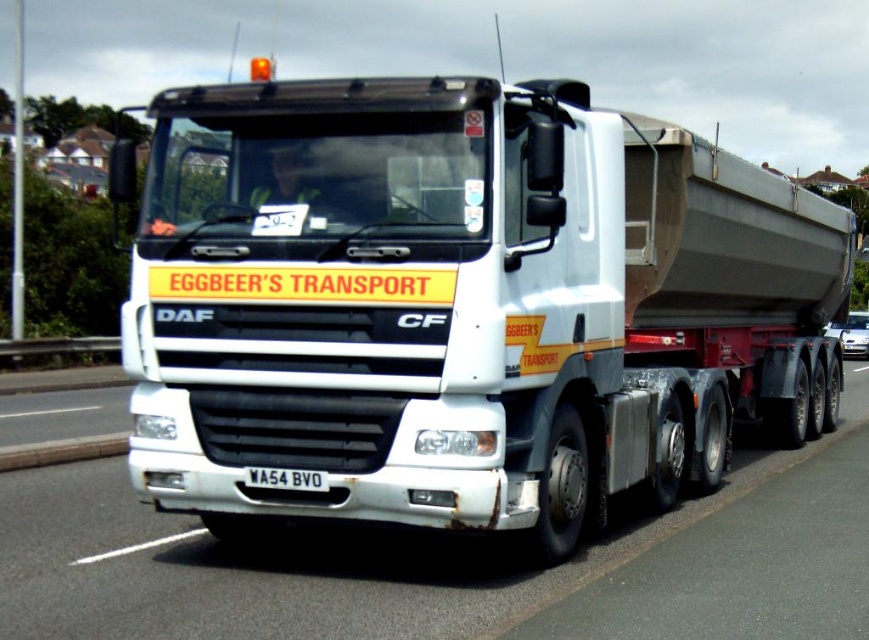
Looking at this image, you are a photographer trying to capture the white matte truck at center and the black plastic license plate at center in a single shot. Given that the truck is much bigger, will the license plate still be clearly visible in the photo?

The white matte truck at center has a larger size compared to the black plastic license plate at center, so the license plate will still be visible but smaller in the photo.

You are a delivery driver who needs to park your white glossy truck at center in a parking lot with a grid system. The parking spot you need to reach is located at coordinate point 0.880, 0.330. Can you confirm if your truck is already positioned correctly at this coordinate?

Yes, the white glossy truck at center is already positioned at coordinate point (x=286, y=563), so it is correctly parked.

You are a photographer trying to capture the white matte truck at center and the white glossy truck at center in a single shot. Given that your camera can only focus on one truck at a time, which truck should you focus on to ensure it appears larger in the final photo?

The white matte truck at center is larger in size than the white glossy truck at center, so focusing on the white matte truck at center will ensure it appears larger in the final photo.